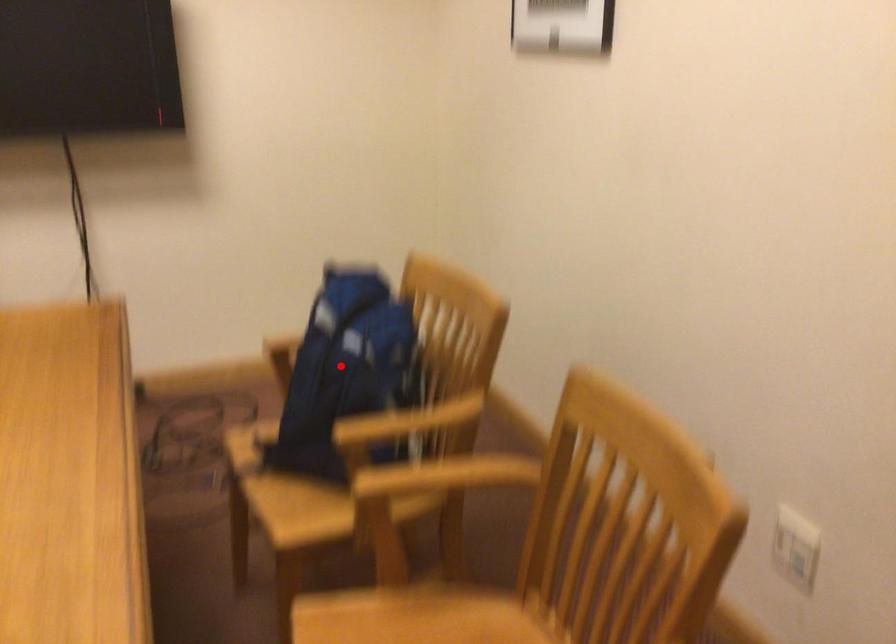
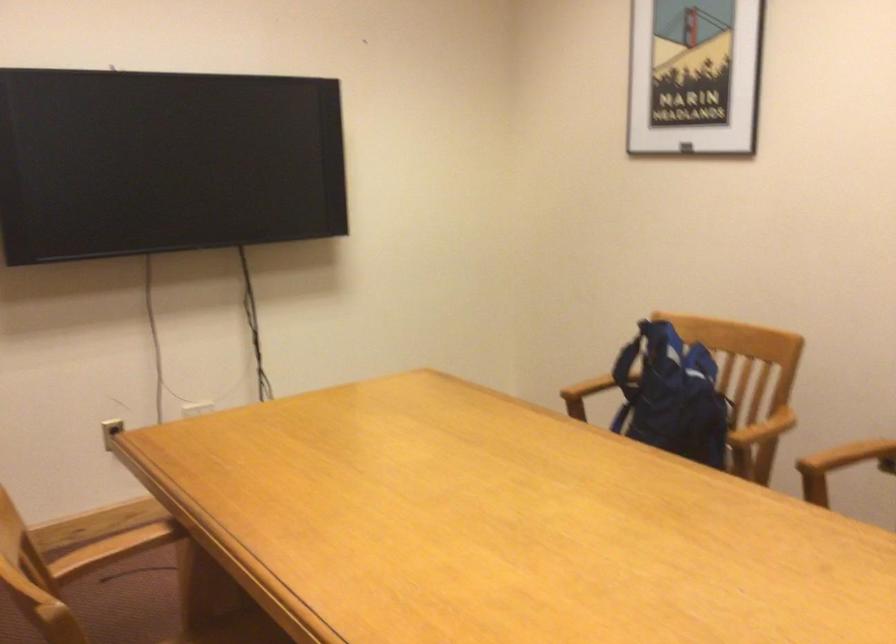
The point at the highlighted location is marked in the first image. Where is the corresponding point in the second image?

(672, 395)